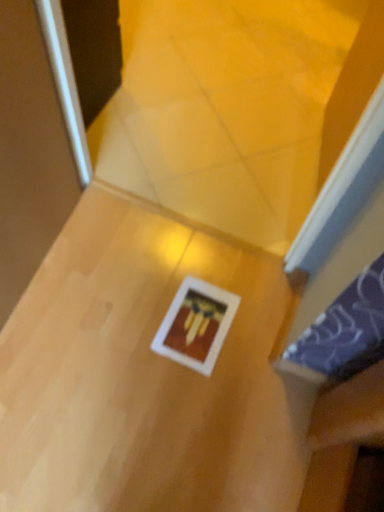
In order to click on blank area beneath white matte picture frame at center (from a real-world perspective) in this screenshot , I will do `click(198, 325)`.